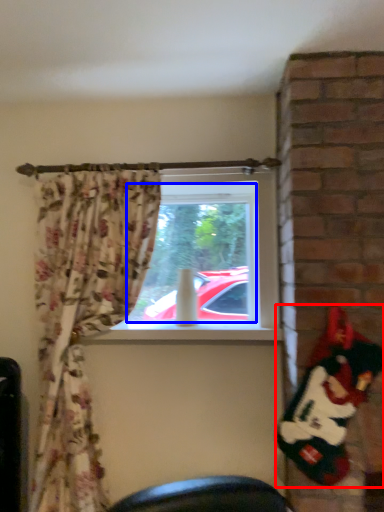
Question: Among these objects, which one is nearest to the camera, santa claus (highlighted by a red box) or window screen (highlighted by a blue box)?

Choices:
 (A) santa claus
 (B) window screen

Answer: (A)